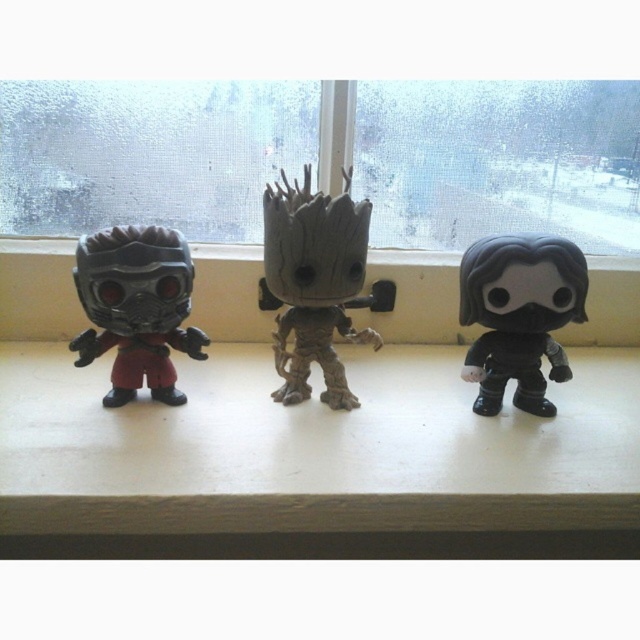
Based on the photo, you are a collector of small figurines and want to place them on a shelf. You have a shelf that can only hold items that are not overlapping. You see the gray textured tree man at center and the matte black figure at left in the image. Which figurine is placed on top of the other?

The gray textured tree man at center is positioned over the matte black figure at left, meaning it is placed on top of the matte black figure at left.